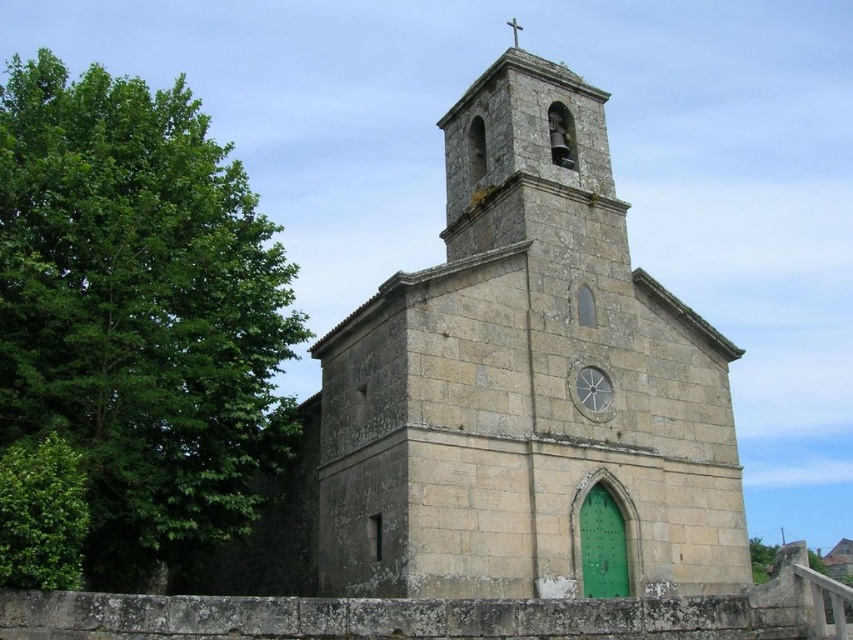
You are standing in front of the stone church at center and the green leafy tree at left. Which one has a greater height?

The green leafy tree at left is taller than the stone church at center.

You are standing in front of the stone church at center and the green leafy tree at left. Which one has a smaller width when viewed from the front?

The stone church at center is thinner than the green leafy tree at left, so the stone church at center has a smaller width when viewed from the front.